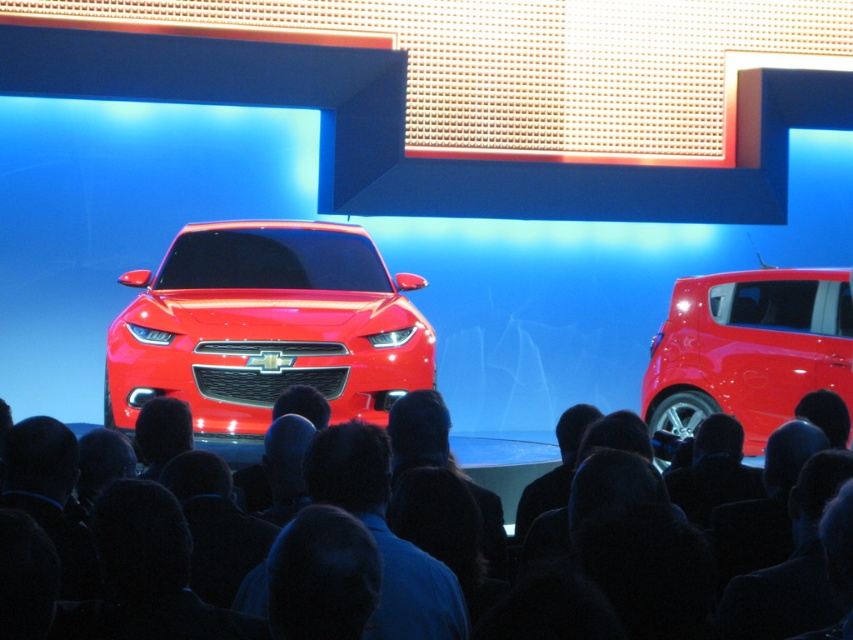
Consider the image. Can you confirm if black hair at center is taller than glossy metallic car at center?

No, black hair at center is not taller than glossy metallic car at center.

Does point (438, 577) come in front of point (258, 333)?

Yes, point (438, 577) is closer to viewer.

Where is `black hair at center`? black hair at center is located at coordinates (190, 570).

In the scene shown: Is glossy metallic car at center thinner than glossy red car at center?

No, glossy metallic car at center is not thinner than glossy red car at center.

Which is more to the right, glossy metallic car at center or glossy red car at center?

From the viewer's perspective, glossy red car at center appears more on the right side.

Identify the location of glossy metallic car at center. (265, 326).

Who is shorter, black hair at center or glossy red car at center?

black hair at center is shorter.

The image size is (853, 640). Identify the location of black hair at center. (190, 570).

The image size is (853, 640). In order to click on black hair at center in this screenshot , I will do coord(190,570).